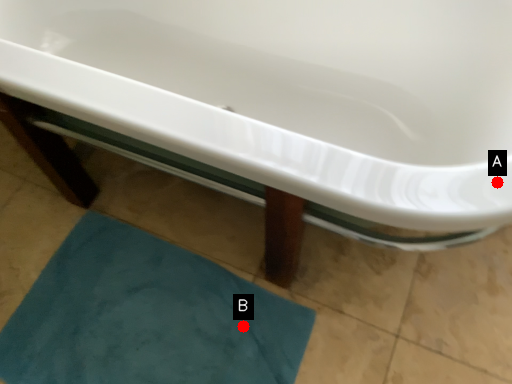
Question: Two points are circled on the image, labeled by A and B beside each circle. Which point is further to the camera?

Choices:
 (A) A is further
 (B) B is further

Answer: (B)